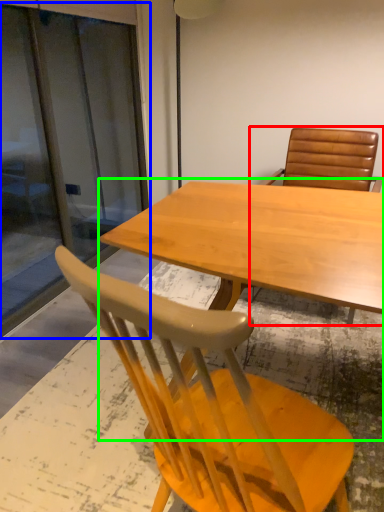
Question: Based on their relative distances, which object is nearer to chair (highlighted by a red box)? Choose from screen door (highlighted by a blue box) and table (highlighted by a green box).

Choices:
 (A) screen door
 (B) table

Answer: (B)